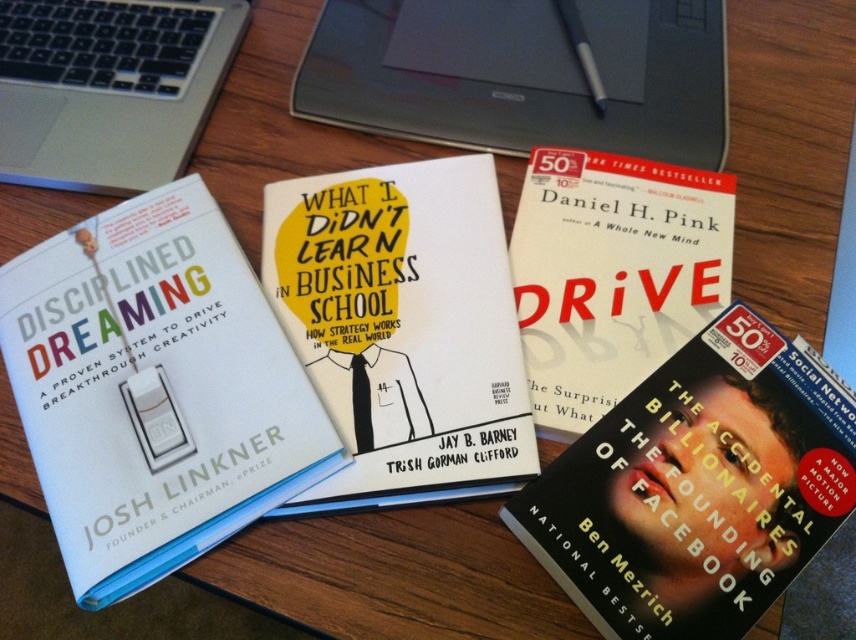
Question: Based on their relative distances, which object is nearer to the hardcover book at center?

Choices:
 (A) white paper book at center
 (B) black matte book at lower right
 (C) silver metallic laptop at upper center

Answer: (B)

Question: Does black matte book at lower right have a greater width compared to silver metallic laptop at upper left?

Choices:
 (A) yes
 (B) no

Answer: (B)

Question: Among these objects, which one is nearest to the camera?

Choices:
 (A) hardcover book at center
 (B) white paper book at center
 (C) silver metallic laptop at upper center

Answer: (B)

Question: Does white matte book at left appear under silver metallic laptop at upper center?

Choices:
 (A) yes
 (B) no

Answer: (A)

Question: Can you confirm if black matte book at lower right is positioned to the right of silver metallic laptop at upper left?

Choices:
 (A) yes
 (B) no

Answer: (A)

Question: Among these points, which one is nearest to the camera?

Choices:
 (A) (437, 131)
 (B) (76, 424)
 (C) (575, 378)

Answer: (B)